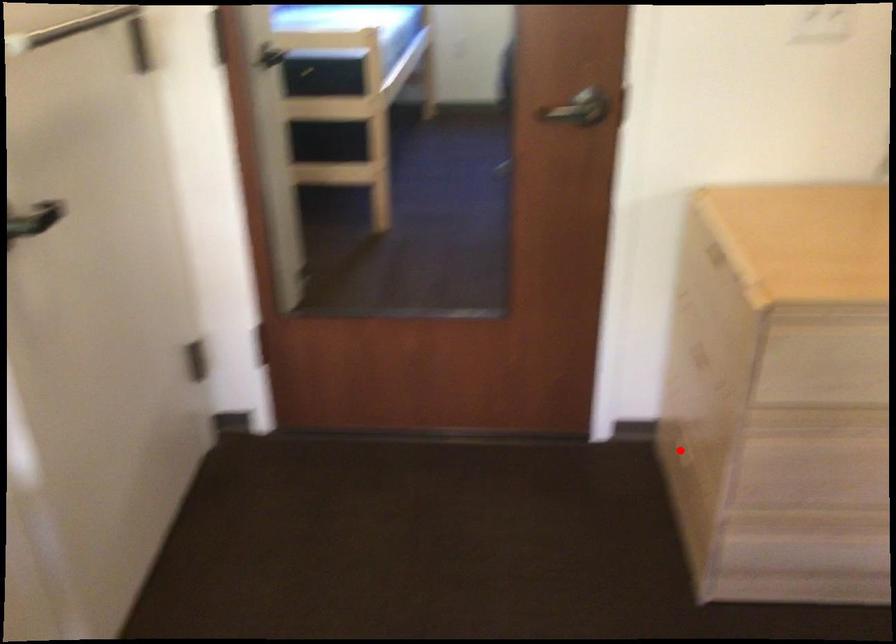
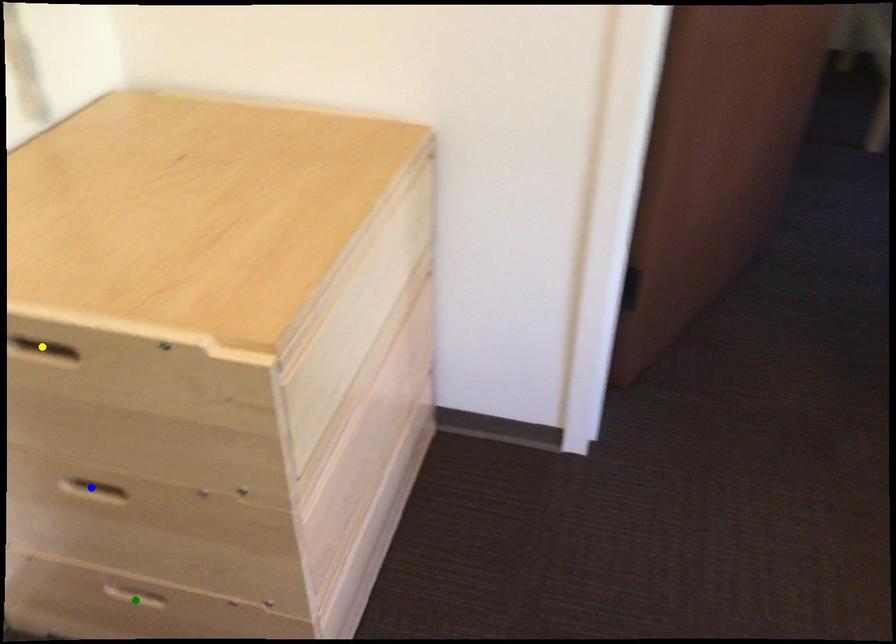
Question: I am providing you with two images of the same scene from different viewpoints. A red point is marked on the first image. You are given multiple points on the second image. Can you choose the point in image 2 that corresponds to the point in image 1?

Choices:
 (A) yellow point
 (B) green point
 (C) blue point

Answer: (B)